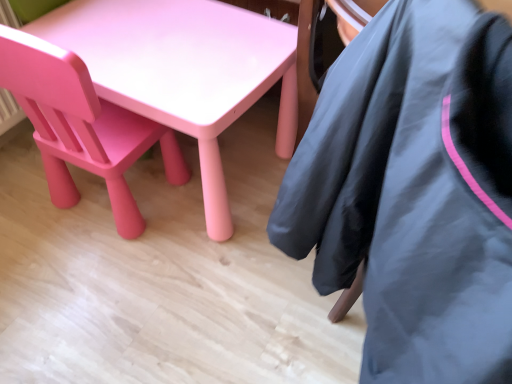
Locate an element on the screen. vacant area in front of matte pink plastic chair at lower left is located at coordinates (100, 276).